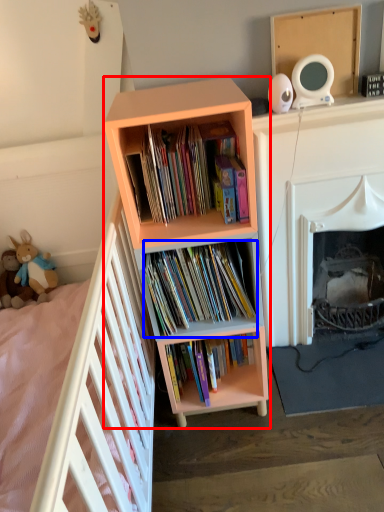
Question: Which object appears farthest to the camera in this image, bookcase (highlighted by a red box) or book (highlighted by a blue box)?

Choices:
 (A) bookcase
 (B) book

Answer: (B)